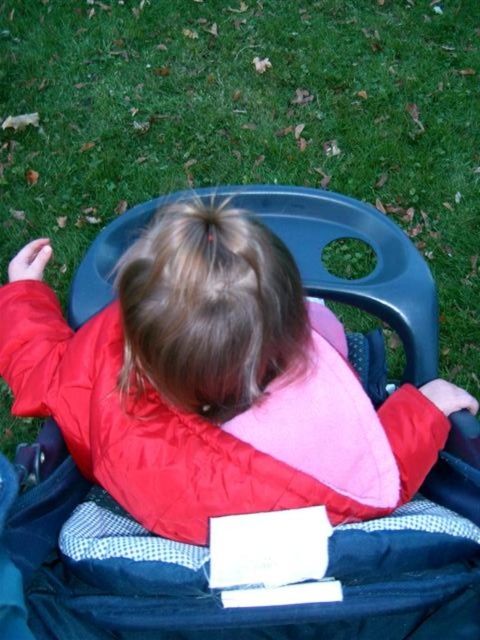
Does green grass at center appear over matte black stroller at center?

Indeed, green grass at center is positioned over matte black stroller at center.

Which is in front, point (284, 60) or point (297, 214)?

Point (297, 214)

Is point (257, 177) positioned after point (383, 481)?

Yes, it is behind point (383, 481).

Find the location of a particular element. The width and height of the screenshot is (480, 640). green grass at center is located at coordinates (248, 120).